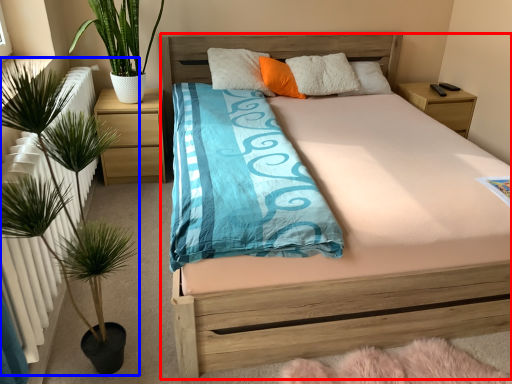
Question: Which of the following is the farthest to the observer, bed (highlighted by a red box) or houseplant (highlighted by a blue box)?

Choices:
 (A) bed
 (B) houseplant

Answer: (A)